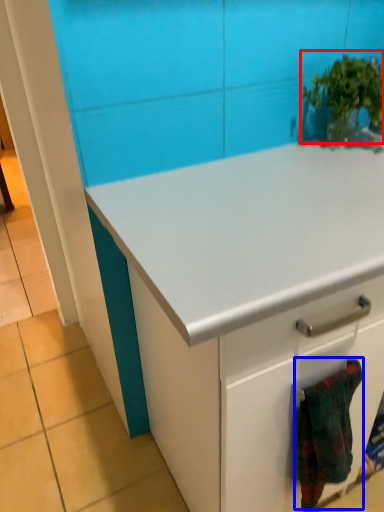
Question: Which of the following is the farthest to the observer, houseplant (highlighted by a red box) or blanket (highlighted by a blue box)?

Choices:
 (A) houseplant
 (B) blanket

Answer: (A)